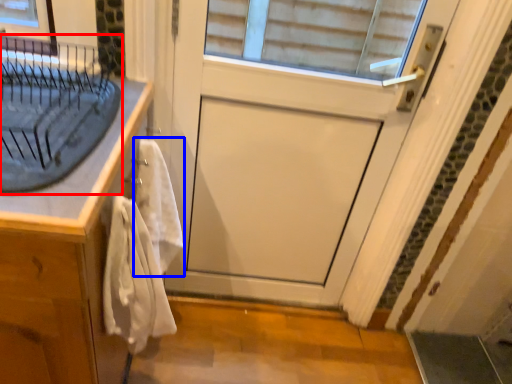
Question: Which point is closer to the camera, sink (highlighted by a red box) or bath towel (highlighted by a blue box)?

Choices:
 (A) sink
 (B) bath towel

Answer: (A)